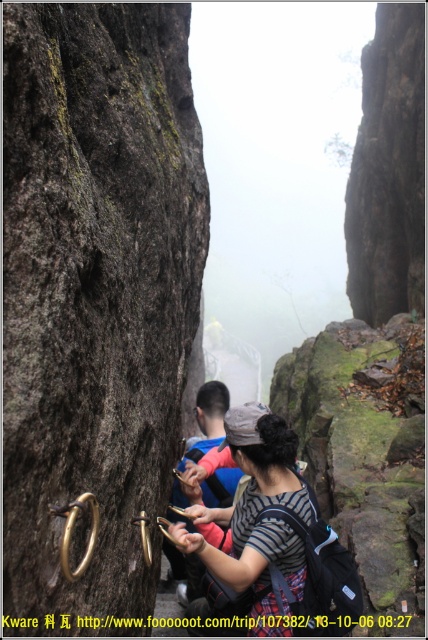
You are a hiker trying to navigate through a narrow canyon. You see two people ahead of you wearing a striped fabric shirt at center and a blue fabric jacket at center. You need to pass between them to continue. Can your 20 inch wide backpack fit through the space between them?

The striped fabric shirt at center and blue fabric jacket at center are 35.38 inches apart. Since your backpack is 20 inches wide, there is enough space to fit through the gap between them.

You are planning to take a photo of the two hikers in the canyon. Given that the striped fabric shirt at center and the blue fabric jacket at center are both in the frame, which one will appear smaller in the photo?

The striped fabric shirt at center will appear smaller in the photo because it occupies less space than the blue fabric jacket at center.

You are a hiker trying to navigate through the canyon. You see the gold metallic rings at lower left and the blue fabric jacket at center. Which object is taller?

The gold metallic rings at lower left are taller than the blue fabric jacket at center.